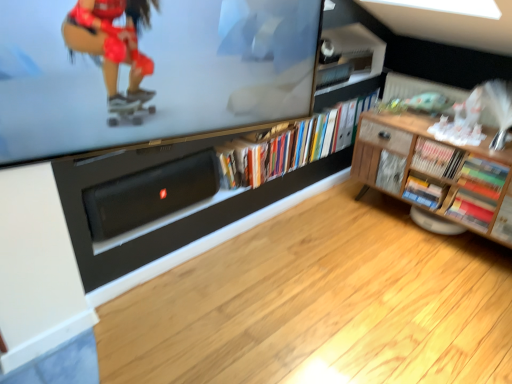
Find the location of a particular element. Image resolution: width=512 pixels, height=384 pixels. free space to the left of wooden cabinet at right is located at coordinates (335, 240).